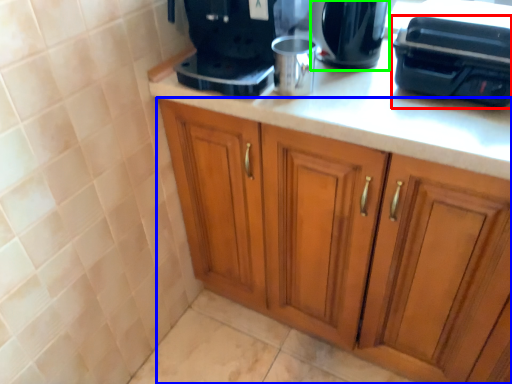
Question: Which object is the farthest from appliance (highlighted by a red box)? Choose among these: cabinetry (highlighted by a blue box) or kitchen appliance (highlighted by a green box).

Choices:
 (A) cabinetry
 (B) kitchen appliance

Answer: (A)